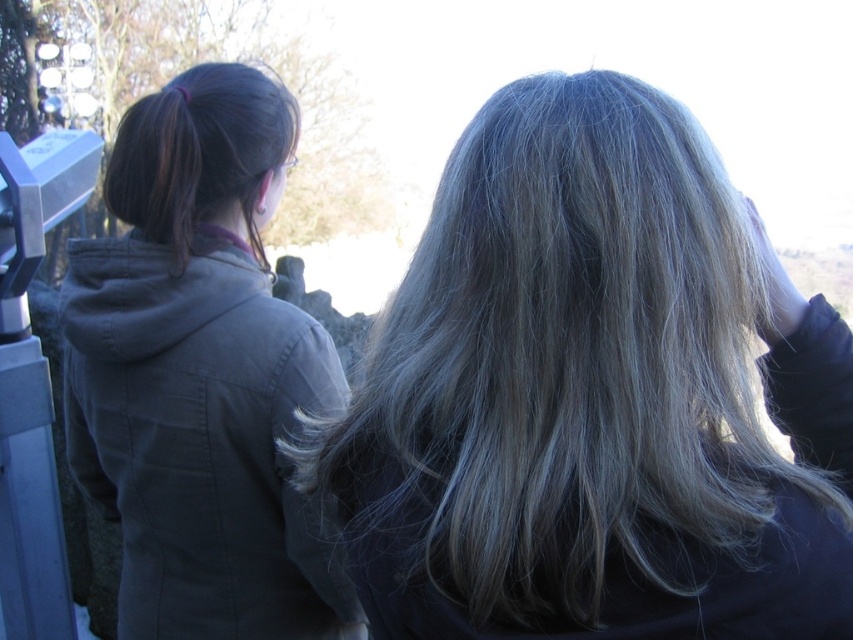
Is blonde hair at center further to camera compared to dark gray hoodie at left?

No, it is in front of dark gray hoodie at left.

Between point (662, 93) and point (273, 385), which one is positioned behind?

The point (273, 385) is more distant.

Is point (828, 628) positioned behind point (102, 332)?

That is False.

Image resolution: width=853 pixels, height=640 pixels. Identify the location of blonde hair at center. (592, 396).

Is dark gray hoodie at left bigger than dark brown silky hair at upper left?

Correct, dark gray hoodie at left is larger in size than dark brown silky hair at upper left.

Which is more to the left, dark gray hoodie at left or dark brown silky hair at upper left?

Answer: Positioned to the left is dark gray hoodie at left.

Is point (258, 298) farther from viewer compared to point (190, 157)?

That is True.

The image size is (853, 640). Find the location of `dark gray hoodie at left`. dark gray hoodie at left is located at coordinates (200, 372).

Who is taller, blonde hair at center or dark brown silky hair at upper left?

Standing taller between the two is blonde hair at center.

Can you confirm if blonde hair at center is thinner than dark brown silky hair at upper left?

In fact, blonde hair at center might be wider than dark brown silky hair at upper left.

Is point (531, 285) less distant than point (236, 88)?

Yes, point (531, 285) is in front of point (236, 88).

Image resolution: width=853 pixels, height=640 pixels. What are the coordinates of `blonde hair at center` in the screenshot? It's located at (592, 396).